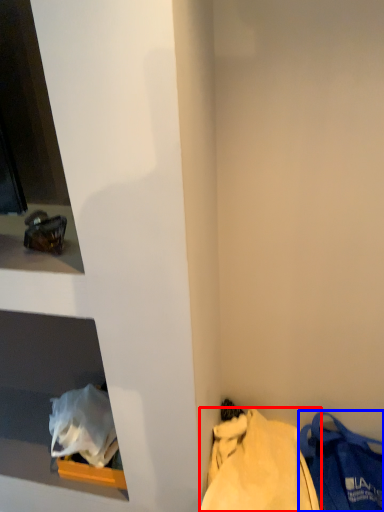
Question: Among these objects, which one is nearest to the camera, tote bag (highlighted by a red box) or handbag (highlighted by a blue box)?

Choices:
 (A) tote bag
 (B) handbag

Answer: (A)